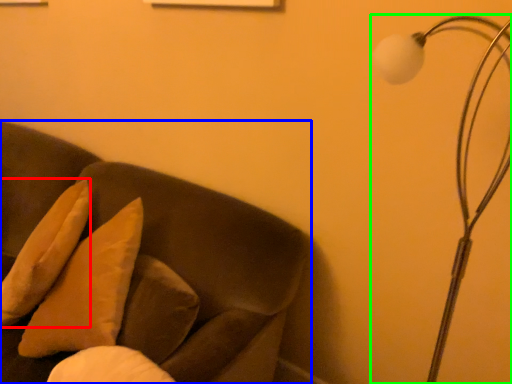
Question: Which object is positioned farthest from pillow (highlighted by a red box)? Select from furniture (highlighted by a blue box) and lamp (highlighted by a green box).

Choices:
 (A) furniture
 (B) lamp

Answer: (B)